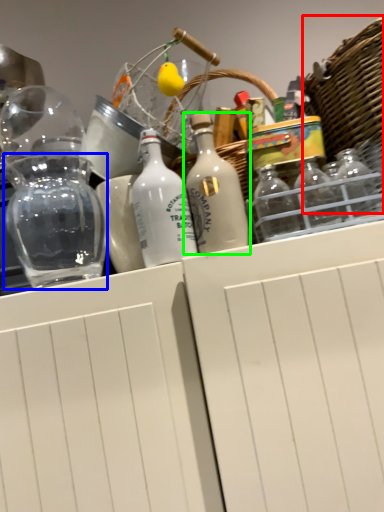
Question: Based on their relative distances, which object is farther from basket (highlighted by a red box)? Choose from glass jar (highlighted by a blue box) and bottle (highlighted by a green box).

Choices:
 (A) glass jar
 (B) bottle

Answer: (A)